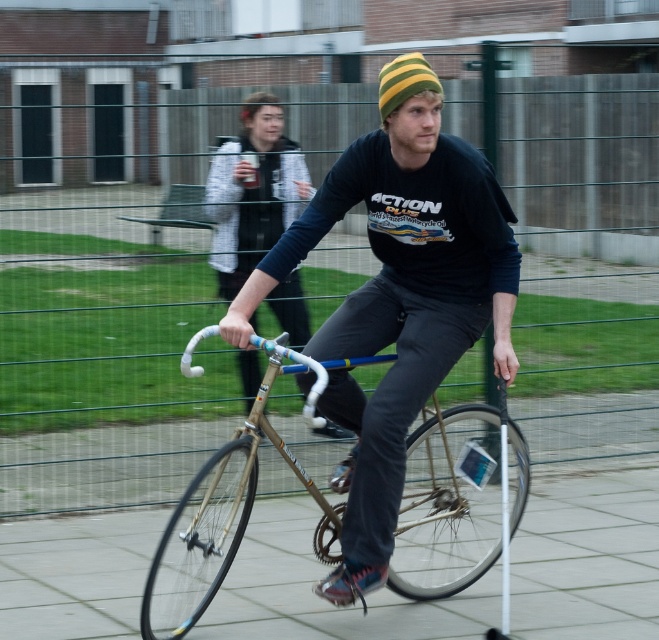
You are standing at the origin point in the image and want to reach the gold metallic bicycle at center. Which direction should you move in to get there?

The gold metallic bicycle at center is located at point 0.784 on the x axis and 0.689 on the y axis, so you should move to the right and forward to reach it.

You are a photographer trying to capture both the matte gold bicycle at center and the striped knit beanie at center in a single frame. Based on their positions, which object should you focus on first to ensure both are in focus?

The matte gold bicycle at center is located below striped knit beanie at center, so you should focus on the striped knit beanie at center first to ensure both are in focus.

You are a delivery robot that needs to place a package on the smooth concrete pavement at center and the striped knit beanie at center. Which surface is wider and can accommodate the package?

The smooth concrete pavement at center is wider than the striped knit beanie at center, so the package can be placed on the smooth concrete pavement at center.